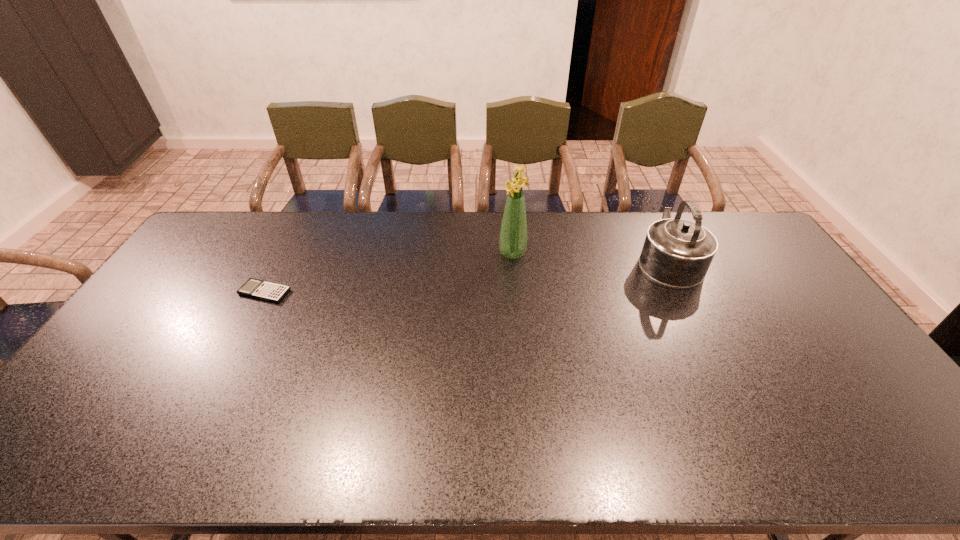
The width and height of the screenshot is (960, 540). What are the coordinates of `free space located with the spout at the front of the kettle` in the screenshot? It's located at (652, 227).

Find the location of a particular element. The image size is (960, 540). vacant space located with the spout at the front of the kettle is located at coordinates (645, 214).

Image resolution: width=960 pixels, height=540 pixels. In order to click on vacant space located on the front of the calculator in this screenshot , I will do `click(221, 377)`.

Where is `bouquet at the far edge`? The image size is (960, 540). bouquet at the far edge is located at coordinates (513, 235).

Image resolution: width=960 pixels, height=540 pixels. What are the coordinates of `kettle at the far edge` in the screenshot? It's located at (677, 253).

The image size is (960, 540). What are the coordinates of `blank area at the far edge` in the screenshot? It's located at (298, 249).

Locate an element on the screen. Image resolution: width=960 pixels, height=540 pixels. vacant space at the near edge is located at coordinates (857, 460).

Find the location of `vacant space at the left edge of the desktop`. vacant space at the left edge of the desktop is located at coordinates (108, 389).

The width and height of the screenshot is (960, 540). What are the coordinates of `empty space that is in between the leftmost object and the rightmost object` in the screenshot? It's located at (467, 276).

Identify the location of vacant area that lies between the rightmost object and the shortest object. The image size is (960, 540). (467, 276).